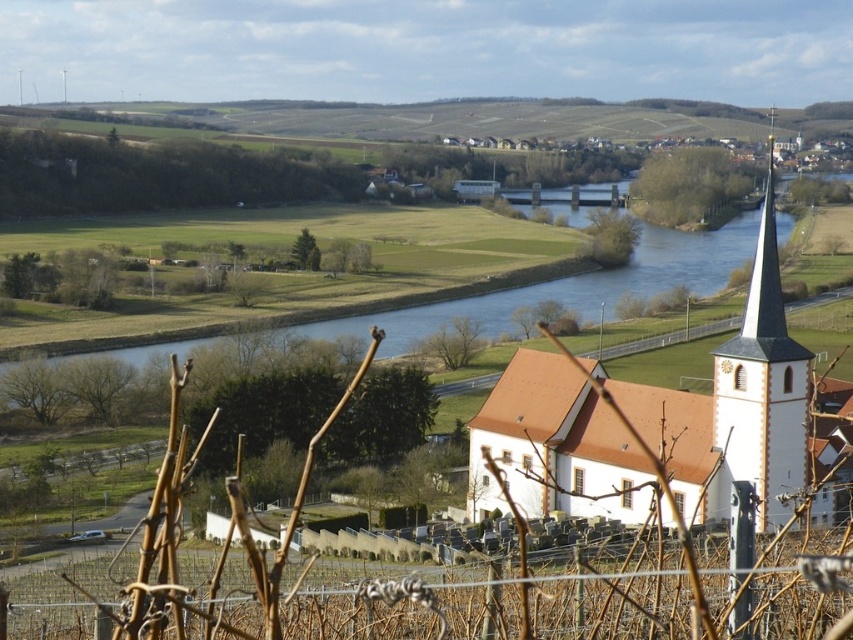
You are standing in the vineyard looking towards the river. You see the white stucco tower at right and the blue water at center. Which object is closer to you?

The white stucco tower at right is closer to you as it is in front of the blue water at center.

Looking at this image, based on the coordinates provided, which object in the scene is located at point (762, 385)?

The white stucco tower at right is located at point (762, 385).